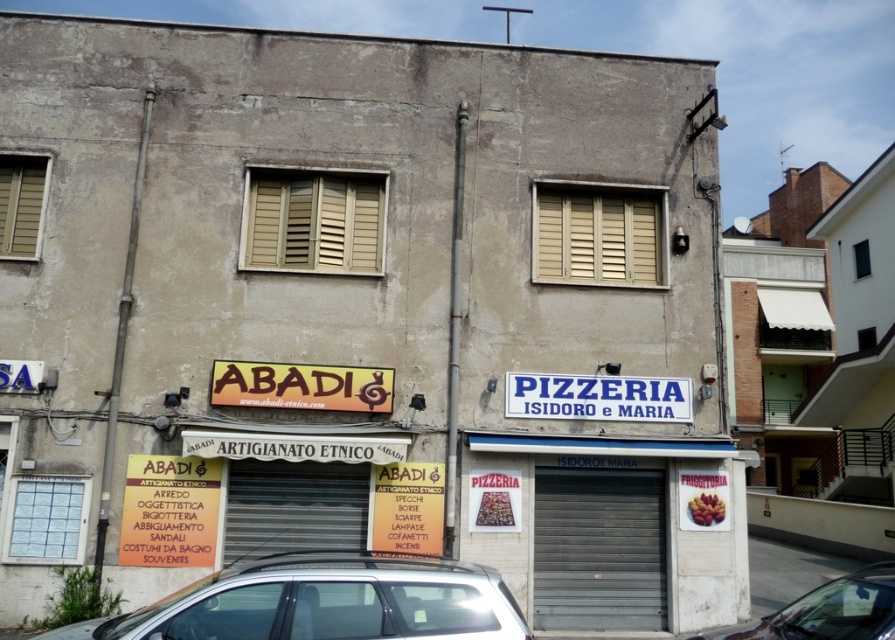
You are a delivery person trying to locate the ABADI ETHNIC HANDICRAFTS store. You see the beige wooden shutters at center and the black matte shutter at center. According to the scene, which one is positioned to the right side?

The beige wooden shutters at center is to the right of the black matte shutter at center.

From the picture: You are a window installer who needs to replace the shutters on the building. You have two shutters available for installation. One is the beige wooden shutters at center and the other is the black matte shutter at center. Which shutter would you choose if you want to install a taller one?

The beige wooden shutters at center is much taller than the black matte shutter at center, so you should choose the beige wooden shutters at center for installation.